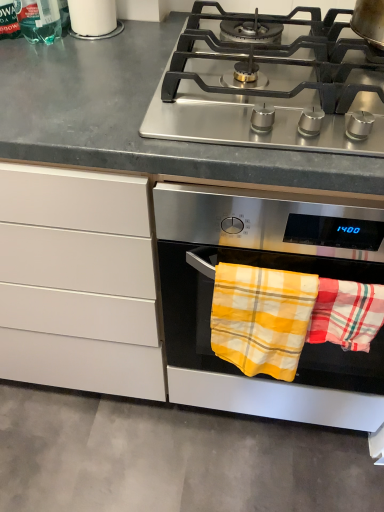
You are a GUI agent. You are given a task and a screenshot of the screen. Output one action in this format:
    pyautogui.click(x=<x>, y=<y>)
    Task: Click on the vacant space in front of translucent green bottle at upper left
    Image resolution: width=384 pixels, height=512 pixels.
    Given the screenshot: What is the action you would take?
    pyautogui.click(x=47, y=69)